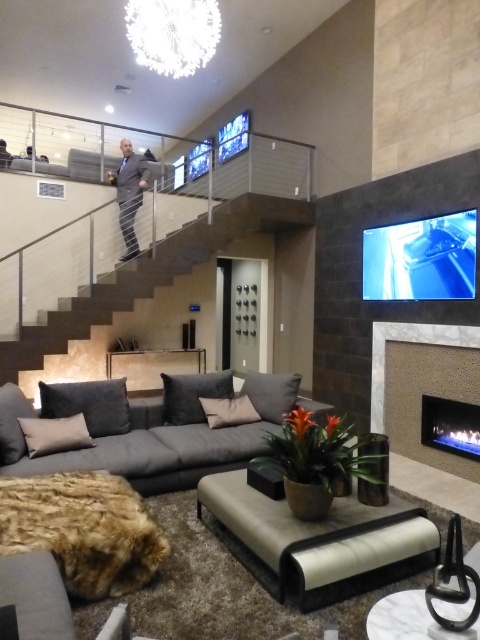
You are a guest in this living room and want to place a 1.5 meter tall decorative sculpture. The sculpture needs to be placed on a surface that can support its height. Which object between the matte beige fireplace at lower right and the dark gray suit at upper center would be the better choice?

The dark gray suit at upper center is taller than the matte beige fireplace at lower right, so placing the 1.5 meter tall decorative sculpture on the dark gray suit at upper center would be more suitable as it can support the sculpture height.

You are a delivery person trying to place a package between the matte beige fireplace at lower right and the dark gray suit at upper center. The package requires a space of 4 meters to fit. Can the space between them accommodate the package?

The distance between the matte beige fireplace at lower right and the dark gray suit at upper center is 4.04 meters, which is slightly more than the 4 meters required. Therefore, the space can accommodate the package.

You are standing in the living room and want to place a new painting on the wall above the dark gray stone stairs at center. However, there is already a dark gray suit at upper center. Can you hang the painting above the stairs without overlapping the existing suit?

The dark gray stone stairs at center is located below the dark gray suit at upper center, so hanging the painting above the stairs might overlap with the dark gray suit at upper center. Choose a different location to avoid overlapping.